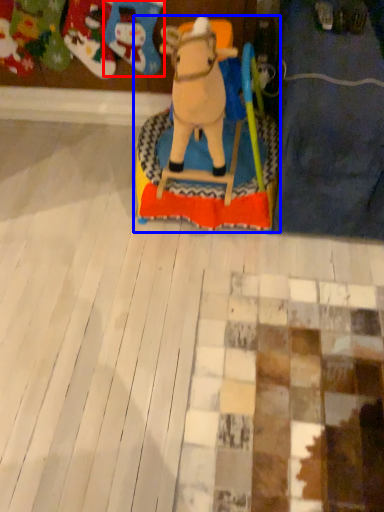
Question: Which object appears farthest to the camera in this image, toy (highlighted by a red box) or toy (highlighted by a blue box)?

Choices:
 (A) toy
 (B) toy

Answer: (A)